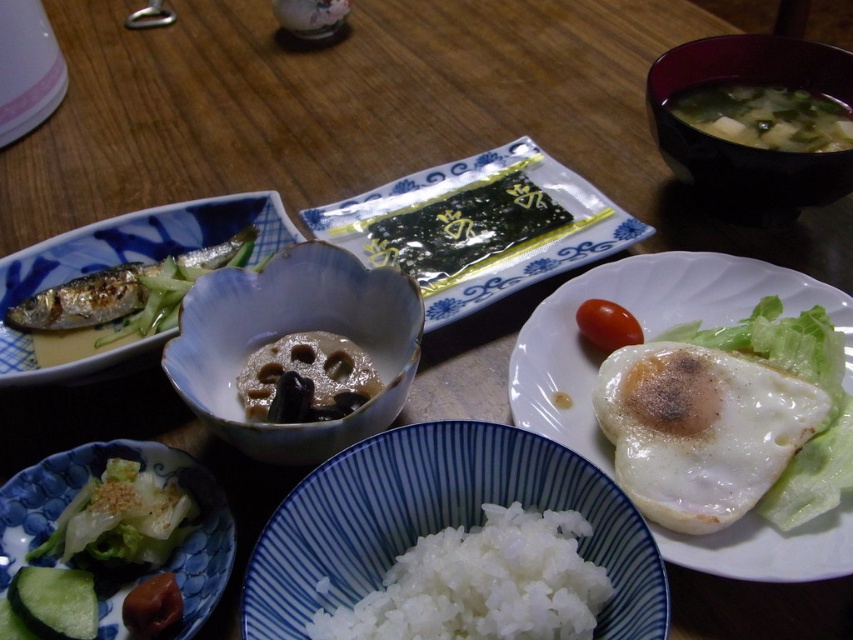
Question: Where is white glossy salad bowl at lower left located in relation to green smooth cucumber at lower left in the image?

Choices:
 (A) right
 (B) left

Answer: (A)

Question: Which object appears closest to the camera in this image?

Choices:
 (A) brown matte lotus root at center
 (B) white fried egg at center
 (C) shiny silver fish at left
 (D) white glossy fried egg at center-right

Answer: (B)

Question: Where is white fried egg at center located in relation to green leafy vegetable at lower left in the image?

Choices:
 (A) right
 (B) left

Answer: (A)

Question: Which point is closer to the camera taking this photo?

Choices:
 (A) (260, 289)
 (B) (146, 467)
 (C) (656, 100)

Answer: (B)

Question: Which object is positioned farthest from the green leafy vegetable soup at upper right?

Choices:
 (A) white glossy fried egg at center-right
 (B) white fried egg at center
 (C) shiny silver fish at upper left

Answer: (C)

Question: Where is white fried egg at center located in relation to brown matte lotus root at center in the image?

Choices:
 (A) below
 (B) above

Answer: (A)